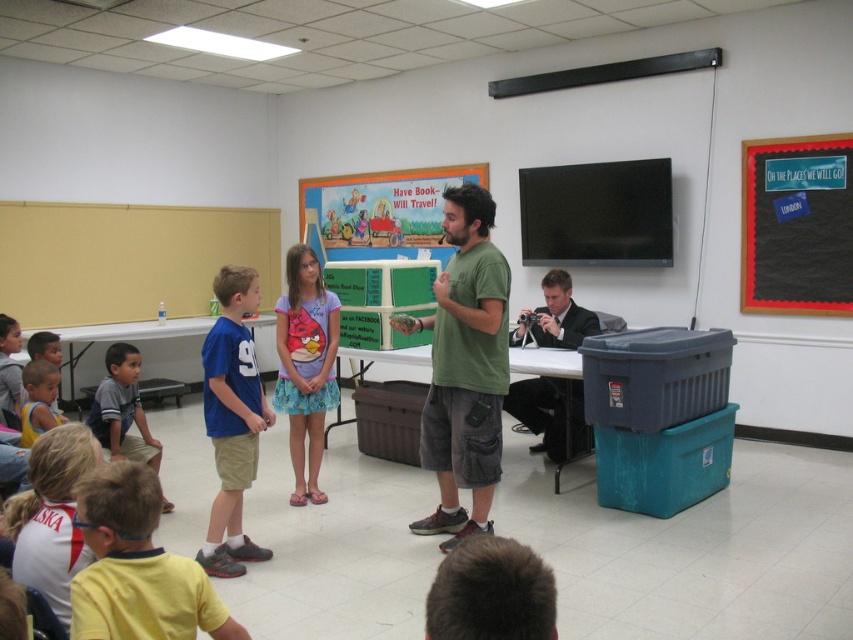
Question: Can you confirm if purple t-shirt at center is thinner than black suit at right?

Choices:
 (A) no
 (B) yes

Answer: (B)

Question: Which object appears farthest from the camera in this image?

Choices:
 (A) black suit at right
 (B) yellow cotton shirt at lower left

Answer: (A)

Question: Does purple t-shirt at center appear under black suit at right?

Choices:
 (A) yes
 (B) no

Answer: (B)

Question: Which point is closer to the camera?

Choices:
 (A) (209, 378)
 (B) (109, 570)
 (C) (749, 260)

Answer: (B)

Question: Is black chalkboard at upper right positioned before purple t-shirt at center?

Choices:
 (A) yes
 (B) no

Answer: (B)

Question: Which point appears farthest from the camera in this image?

Choices:
 (A) (212, 353)
 (B) (316, 340)
 (C) (479, 316)
 (D) (573, 440)

Answer: (D)